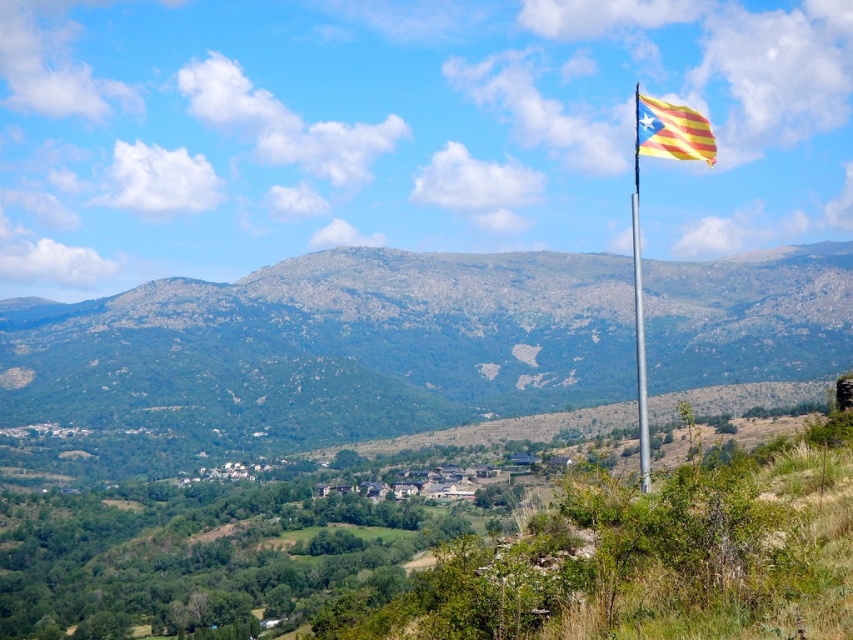
You are an architect designing a new hiking trail that needs to pass between the green rocky mountain at center and the yellow striped fabric at upper right. Given that the trail must be wide enough for two hikers to walk side by side, which requires a minimum width of 2 meters, can the space between them accommodate this requirement?

The green rocky mountain at center is larger than the yellow striped fabric at upper right, but the description does not provide specific measurements of the distance between them. Therefore, it is impossible to determine if the space between them is wide enough for the trail.